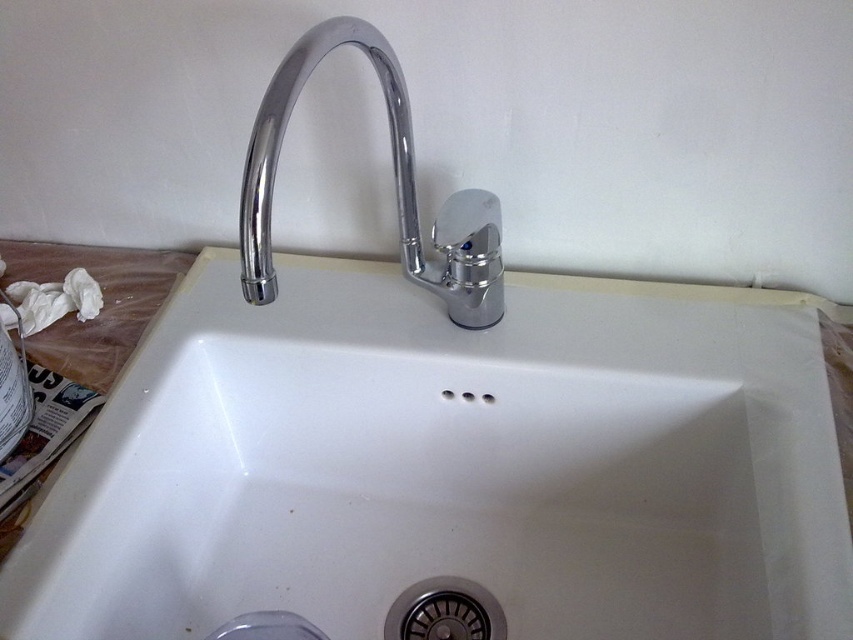
Does white ceramic sink at center appear under polished chrome faucet at center?

Correct, white ceramic sink at center is located below polished chrome faucet at center.

Can you confirm if white ceramic sink at center is thinner than polished chrome faucet at center?

Incorrect, white ceramic sink at center's width is not less than polished chrome faucet at center's.

Based on the photo, measure the distance between point (750,433) and camera.

Point (750,433) is 63.77 centimeters away from camera.

The image size is (853, 640). I want to click on white ceramic sink at center, so click(451, 465).